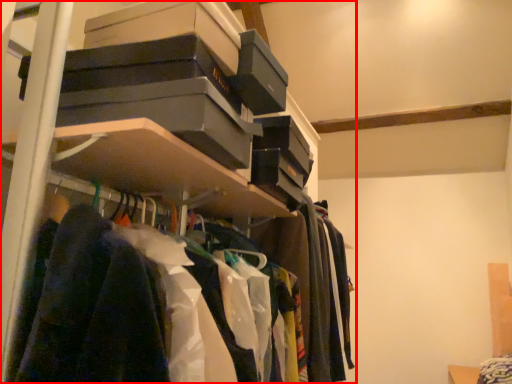
Question: Considering the relative positions of shelf (annotated by the red box) and clothing in the image provided, where is shelf (annotated by the red box) located with respect to the staircase?

Choices:
 (A) right
 (B) left

Answer: (A)